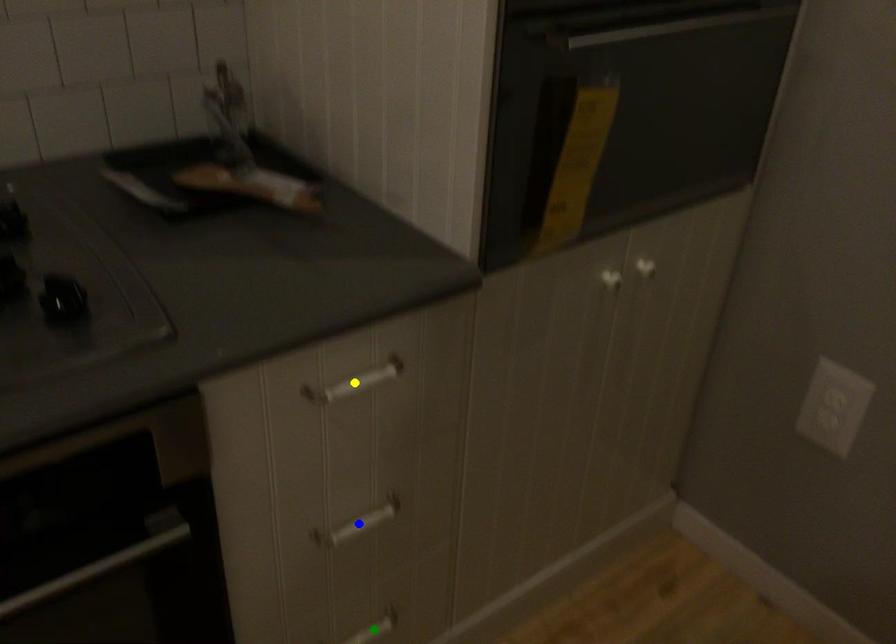
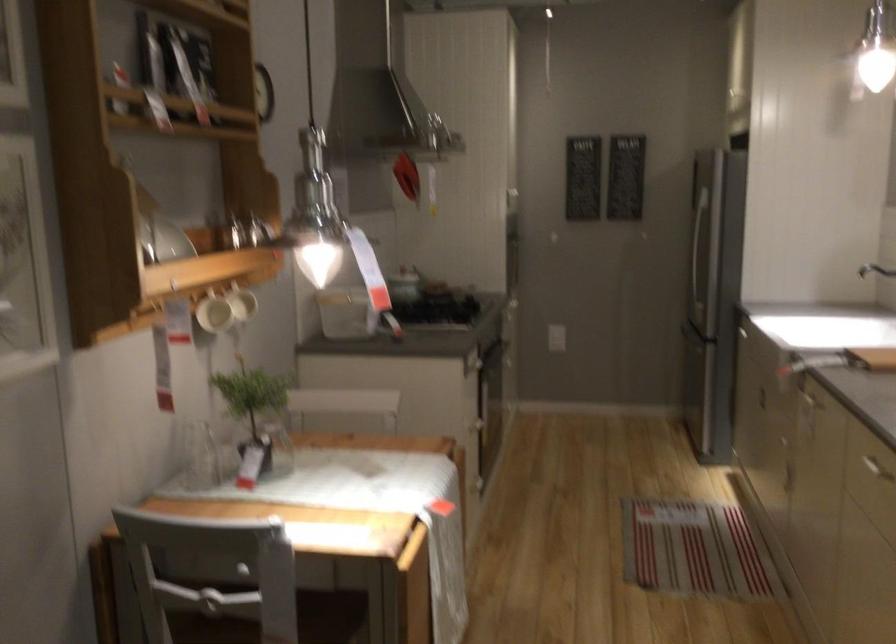
I am providing you with two images of the same scene from different viewpoints. Three points are marked in image1. Which point corresponds to a part or object that is occluded in image2?In image1, three points are marked. Which of them correspond to a part or object that is occluded in image2?Among the three points shown in image1, which one corresponds to a part or object that is no longer visible due to occlusion in image2?

Invisible in image2: yellow point, blue point, green point.